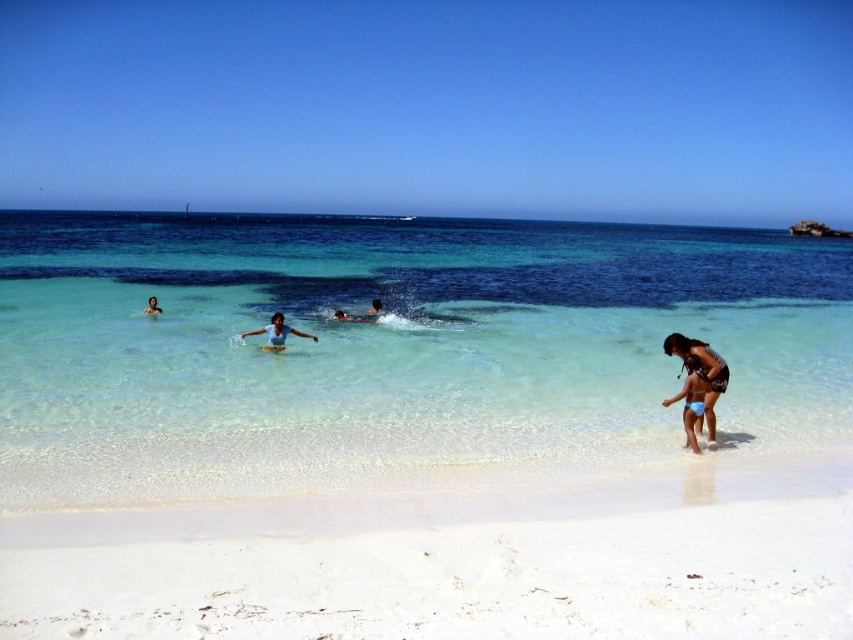
Question: Which of the following is the farthest from the observer?

Choices:
 (A) coord(706,342)
 (B) coord(152,307)
 (C) coord(368,308)
 (D) coord(579,628)

Answer: (C)

Question: Which object is farther from the camera taking this photo?

Choices:
 (A) clear water at center
 (B) white sandy beach at lower center
 (C) smooth skin person at center

Answer: (C)

Question: In this image, where is clear water at center located relative to matte blue swimsuit at center?

Choices:
 (A) above
 (B) below

Answer: (A)

Question: Which object is positioned closest to the matte blue swimsuit at center?

Choices:
 (A) light blue fabric at center
 (B) clear water at center
 (C) smooth skin person at center

Answer: (C)

Question: Does matte black bikini at lower right appear over matte blue swimsuit at center?

Choices:
 (A) yes
 (B) no

Answer: (B)

Question: Is white sandy beach at lower center bigger than matte blue swimsuit at center?

Choices:
 (A) no
 (B) yes

Answer: (A)